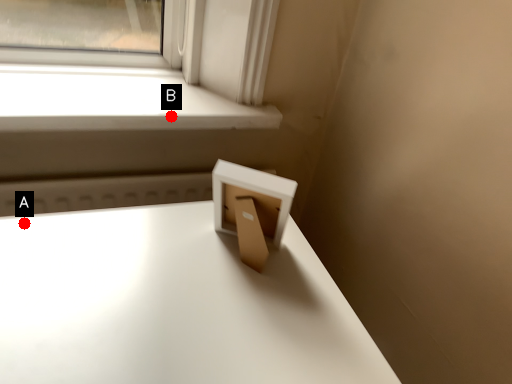
Question: Two points are circled on the image, labeled by A and B beside each circle. Which point is farther from the camera taking this photo?

Choices:
 (A) A is further
 (B) B is further

Answer: (B)